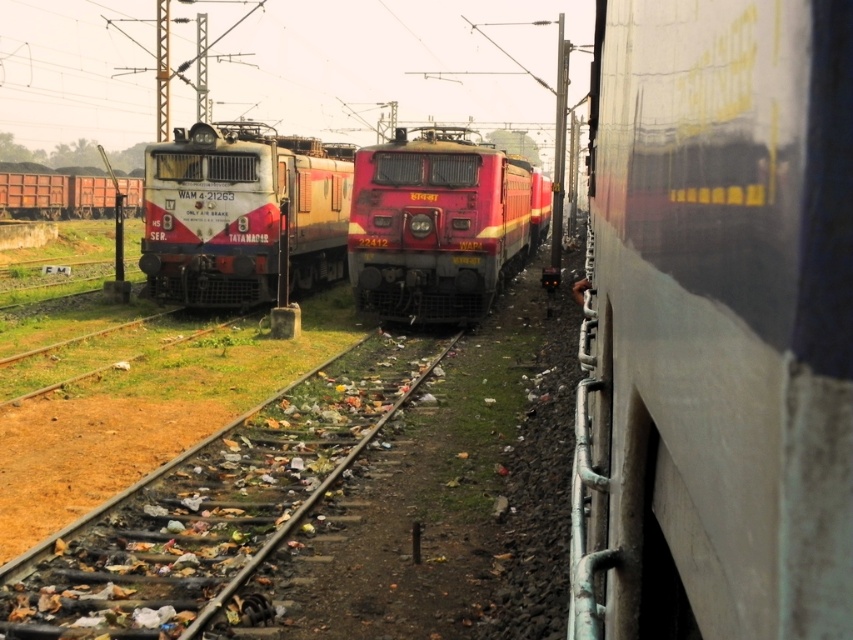
Is matte red locomotive at center to the left of matte red train at center from the viewer's perspective?

Indeed, matte red locomotive at center is positioned on the left side of matte red train at center.

Which is below, matte red locomotive at center or matte red train at center?

matte red locomotive at center

Measure the distance between point (242, 163) and camera.

The distance of point (242, 163) from camera is 19.89 meters.

Image resolution: width=853 pixels, height=640 pixels. I want to click on matte red locomotive at center, so click(241, 212).